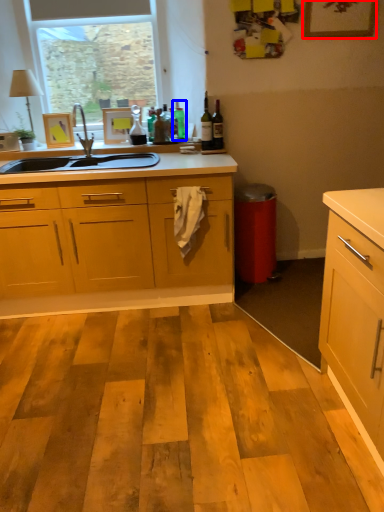
Question: Which object appears farthest to the camera in this image, picture frame (highlighted by a red box) or bottle (highlighted by a blue box)?

Choices:
 (A) picture frame
 (B) bottle

Answer: (B)